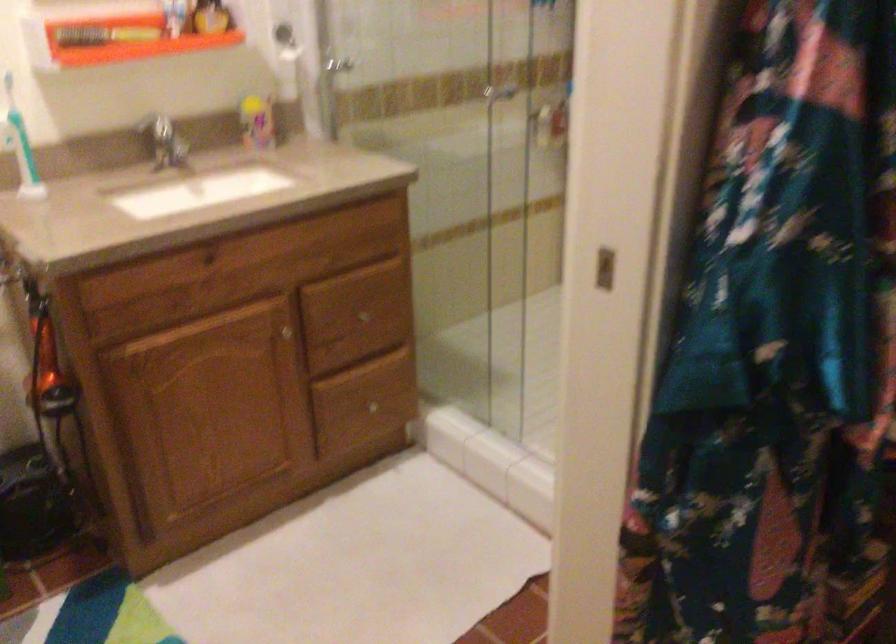
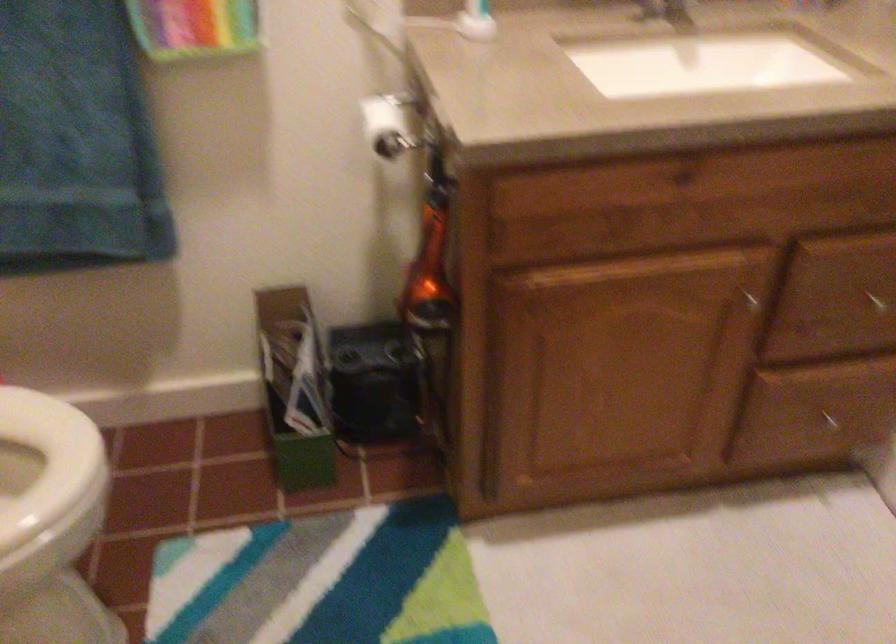
The point at (374, 409) is marked in the first image. Where is the corresponding point in the second image?

(831, 422)